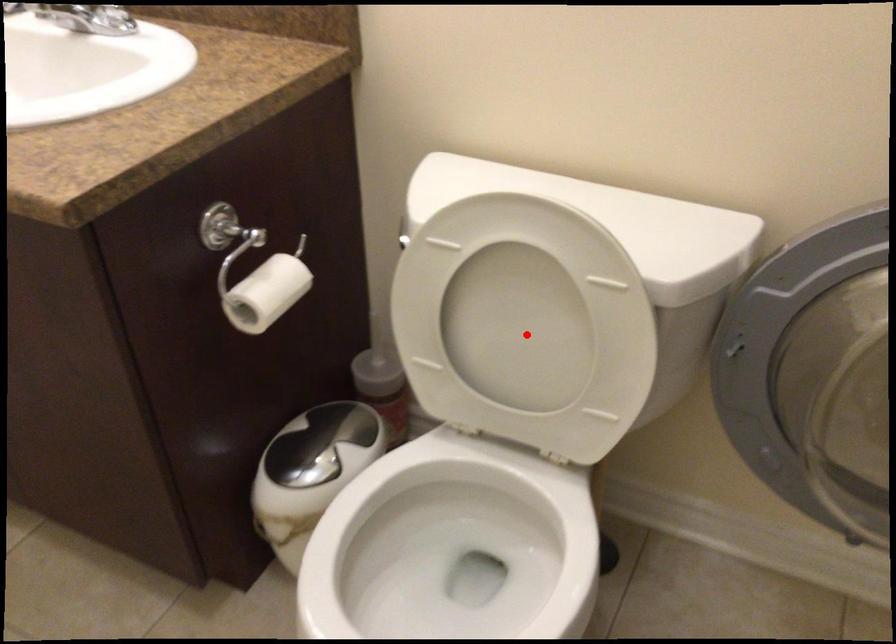
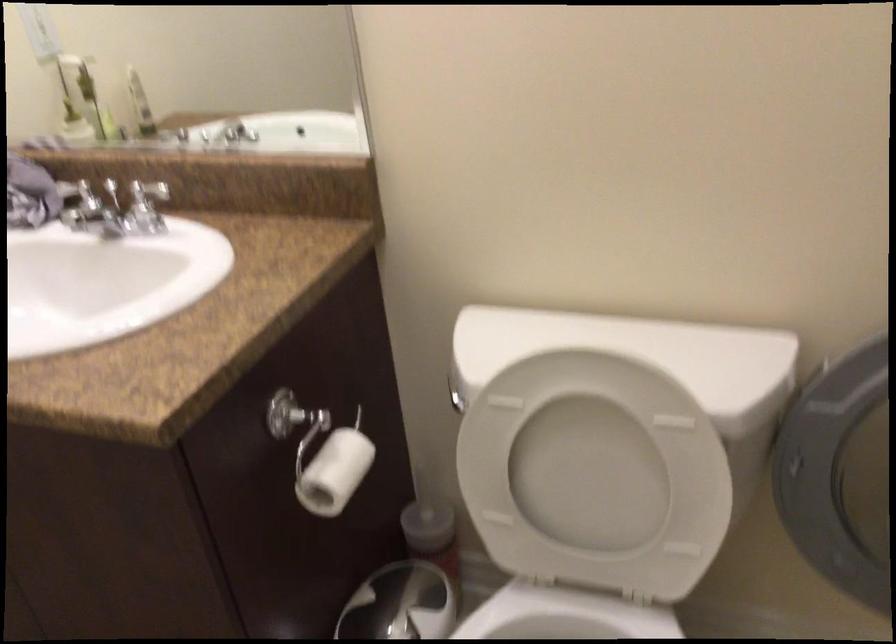
The point at the highlighted location is marked in the first image. Where is the corresponding point in the second image?

(595, 475)